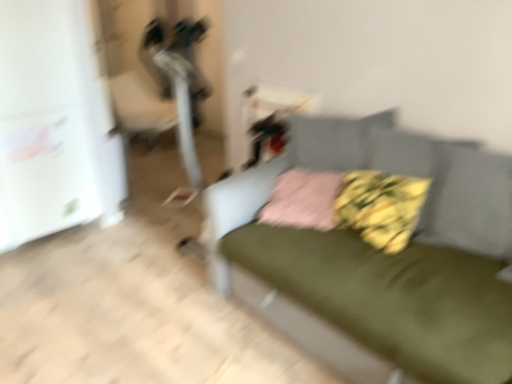
Question: Can you see green fabric couch at center touching fluffy yellow pillow at center, which is the 2th pillow in left-to-right order?

Choices:
 (A) yes
 (B) no

Answer: (B)

Question: Is green fabric couch at center bigger than fluffy yellow pillow at center, which is the first pillow in right-to-left order?

Choices:
 (A) yes
 (B) no

Answer: (A)

Question: Does green fabric couch at center appear on the right side of fluffy yellow pillow at center, which is the first pillow in right-to-left order?

Choices:
 (A) no
 (B) yes

Answer: (A)

Question: Is green fabric couch at center located outside fluffy yellow pillow at center, which is the first pillow in right-to-left order?

Choices:
 (A) no
 (B) yes

Answer: (B)

Question: From the image's perspective, would you say green fabric couch at center is shown under fluffy yellow pillow at center, which is the 2th pillow in left-to-right order?

Choices:
 (A) no
 (B) yes

Answer: (B)

Question: Is green fabric couch at center far away from fluffy yellow pillow at center, which is the 2th pillow in left-to-right order?

Choices:
 (A) yes
 (B) no

Answer: (B)

Question: Does pink fabric pillow at center, acting as the first pillow starting from the left, lie behind green fabric couch at center?

Choices:
 (A) no
 (B) yes

Answer: (B)

Question: Is pink fabric pillow at center, acting as the first pillow starting from the left, thinner than green fabric couch at center?

Choices:
 (A) no
 (B) yes

Answer: (B)

Question: Is pink fabric pillow at center, acting as the first pillow starting from the left, to the right of green fabric couch at center from the viewer's perspective?

Choices:
 (A) no
 (B) yes

Answer: (A)

Question: Is pink fabric pillow at center, acting as the first pillow starting from the left, turned away from green fabric couch at center?

Choices:
 (A) no
 (B) yes

Answer: (B)

Question: Could you tell me if pink fabric pillow at center, which is the 2th pillow from right to left, is turned towards green fabric couch at center?

Choices:
 (A) no
 (B) yes

Answer: (B)

Question: From a real-world perspective, is pink fabric pillow at center, which is the 2th pillow from right to left, positioned over green fabric couch at center based on gravity?

Choices:
 (A) no
 (B) yes

Answer: (B)

Question: Is green fabric couch at center aimed at pink fabric pillow at center, which is the 2th pillow from right to left?

Choices:
 (A) yes
 (B) no

Answer: (A)